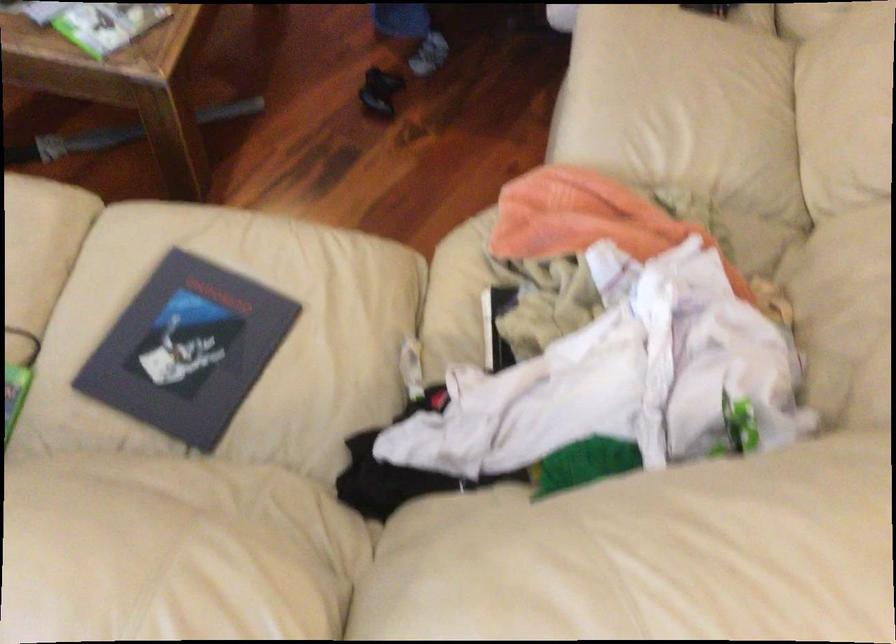
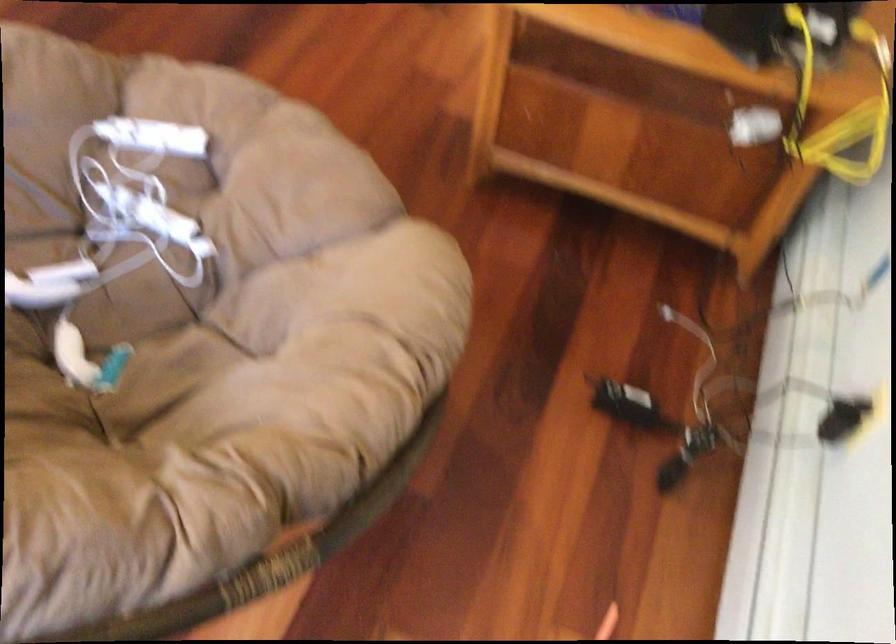
Which direction would the cameraman need to move to produce the second image?

The cameraman walked toward right, backward.